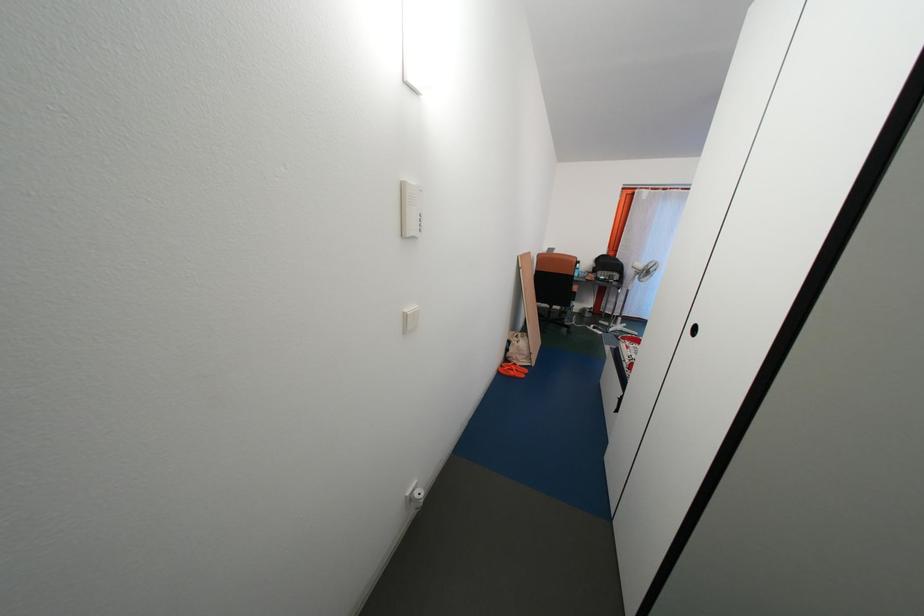
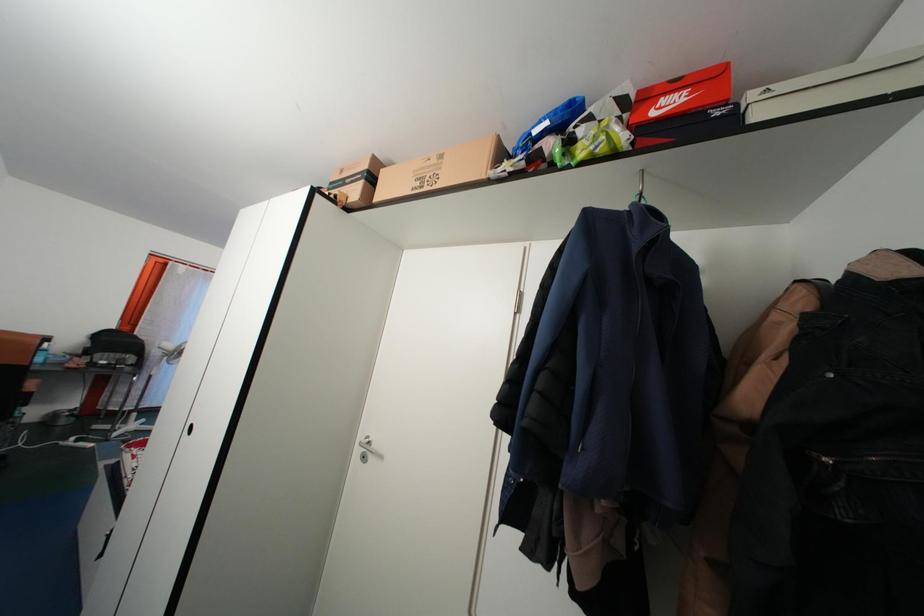
Question: How did the camera likely rotate?

Choices:
 (A) Left
 (B) Right
 (C) Up
 (D) Down

Answer: (B)